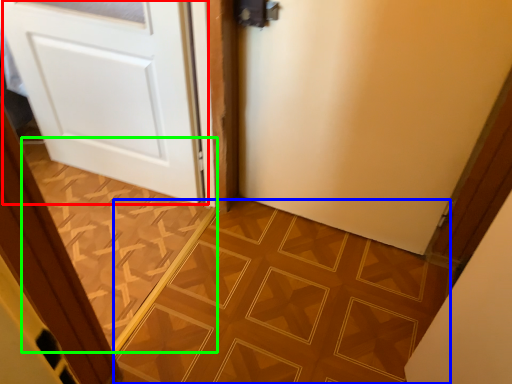
Question: Which object is the farthest from door (highlighted by a red box)? Choose among these: ceramic tile (highlighted by a blue box) or ceramic tile (highlighted by a green box).

Choices:
 (A) ceramic tile
 (B) ceramic tile

Answer: (A)